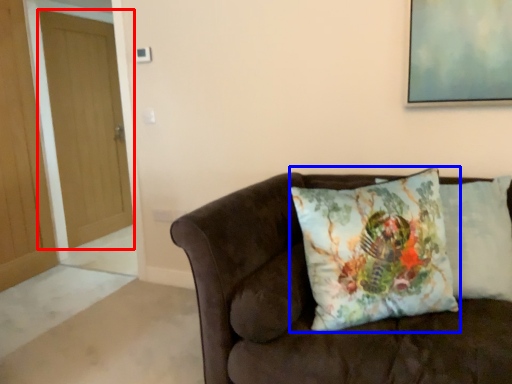
Question: Which object is closer to the camera taking this photo, door (highlighted by a red box) or pillow (highlighted by a blue box)?

Choices:
 (A) door
 (B) pillow

Answer: (B)